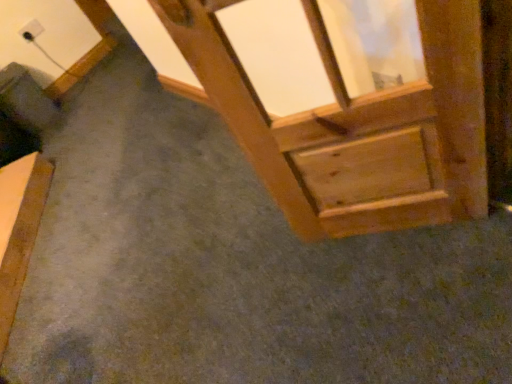
At what (x,y) coordinates should I click in order to perform the action: click on blank space to the left of wooden frame at upper right. Please return your answer as a coordinate pair (x, y). This screenshot has height=384, width=512. Looking at the image, I should click on (297, 276).